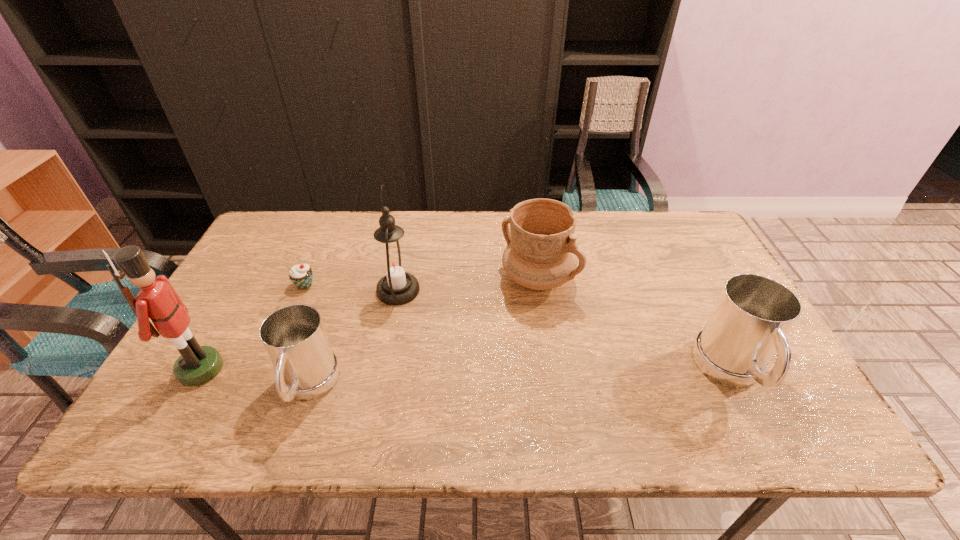
Identify the location of the left mug. (294, 336).

The image size is (960, 540). Find the location of `the shorter mug`. the shorter mug is located at coordinates (294, 336).

Find the location of a particular element. This screenshot has height=540, width=960. the rightmost object is located at coordinates (753, 314).

Where is `the right mug`? the right mug is located at coordinates (753, 314).

You are a GUI agent. You are given a task and a screenshot of the screen. Output one action in this format:
    pyautogui.click(x=<x>, y=<y>)
    Task: Click on the fifth object from right to left
    
    Given the screenshot: What is the action you would take?
    pyautogui.click(x=301, y=275)

Where is `cupcake`? The image size is (960, 540). cupcake is located at coordinates (301, 275).

Locate an element on the screen. The width and height of the screenshot is (960, 540). pottery is located at coordinates (541, 254).

Where is `the third object from right to left`? This screenshot has width=960, height=540. the third object from right to left is located at coordinates (393, 263).

Where is `nutcracker`? Image resolution: width=960 pixels, height=540 pixels. nutcracker is located at coordinates (157, 299).

Identify the location of free space located on the right of the cupcake. (362, 285).